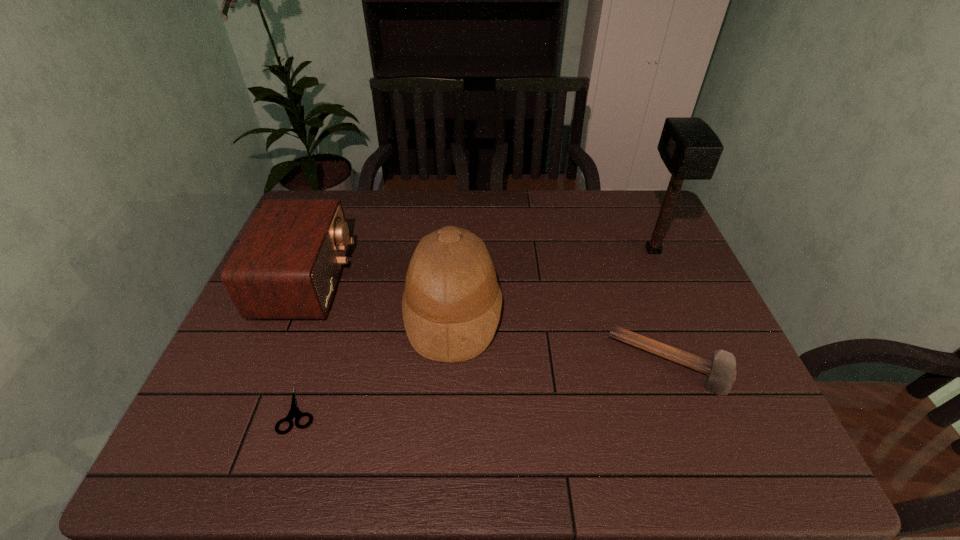
At what (x,y) coordinates should I click in order to perform the action: click on the tallest object. Please return your answer as a coordinate pair (x, y). This screenshot has height=540, width=960. Looking at the image, I should click on (690, 149).

Locate an element on the screen. The height and width of the screenshot is (540, 960). the taller mallet is located at coordinates (690, 149).

The image size is (960, 540). I want to click on hat, so pos(451,305).

This screenshot has height=540, width=960. What are the coordinates of `the fourth shortest object` in the screenshot? It's located at (451, 305).

Where is `the third shortest object`? the third shortest object is located at coordinates (287, 265).

The image size is (960, 540). What are the coordinates of `the nearer mallet` in the screenshot? It's located at (720, 371).

The image size is (960, 540). What are the coordinates of `the second shortest object` in the screenshot? It's located at (720, 371).

Locate an element on the screen. shears is located at coordinates point(294,412).

Locate an element on the screen. This screenshot has width=960, height=540. vacant space located on the left of the tallest object is located at coordinates (541, 251).

Locate an element on the screen. This screenshot has height=540, width=960. free region located 0.280m on the front-facing side of the fourth shortest object is located at coordinates (608, 313).